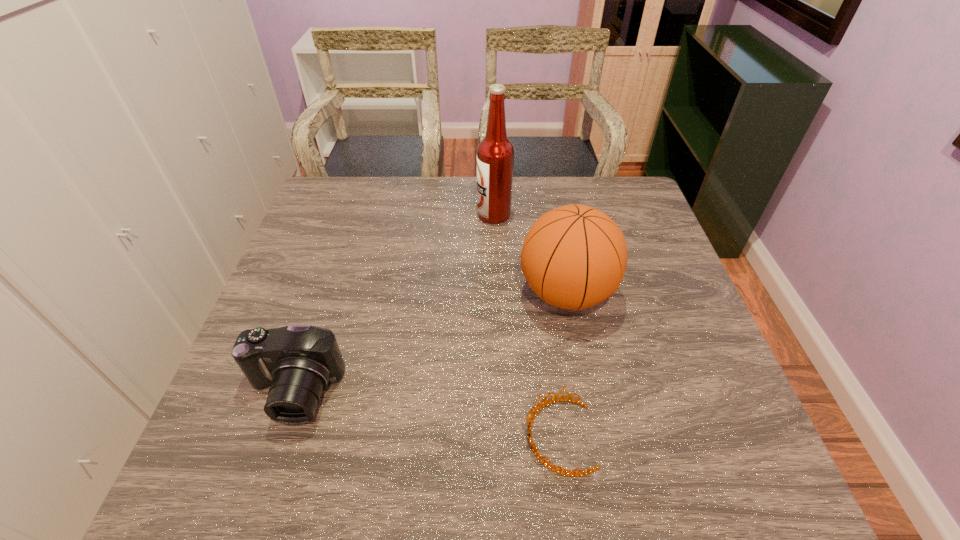
This screenshot has height=540, width=960. What are the coordinates of `alcohol` in the screenshot? It's located at (495, 153).

Where is `the tallest object`? This screenshot has width=960, height=540. the tallest object is located at coordinates (495, 153).

You are a GUI agent. You are given a task and a screenshot of the screen. Output one action in this format:
    pyautogui.click(x=<x>, y=<y>)
    Task: Click on the third shortest object
    
    Given the screenshot: What is the action you would take?
    pyautogui.click(x=574, y=257)

Where is `basketball`? basketball is located at coordinates pos(574,257).

The width and height of the screenshot is (960, 540). Find the location of `the leftmost object`. the leftmost object is located at coordinates (298, 362).

What are the coordinates of `camera` in the screenshot? It's located at (298, 362).

This screenshot has height=540, width=960. Find the location of `tiara`. tiara is located at coordinates (530, 419).

You are a GUI agent. You are given a task and a screenshot of the screen. Output one action in this format:
    pyautogui.click(x=<x>, y=<y>)
    Task: Click on the vacant area situated on the label side of the tallest object
    The image size is (960, 540).
    Given the screenshot: What is the action you would take?
    pyautogui.click(x=412, y=214)

The height and width of the screenshot is (540, 960). I want to click on free point located on the label side of the tallest object, so click(x=419, y=214).

Identify the location of free region located 0.340m on the label side of the tallest object. This screenshot has width=960, height=540. (367, 214).